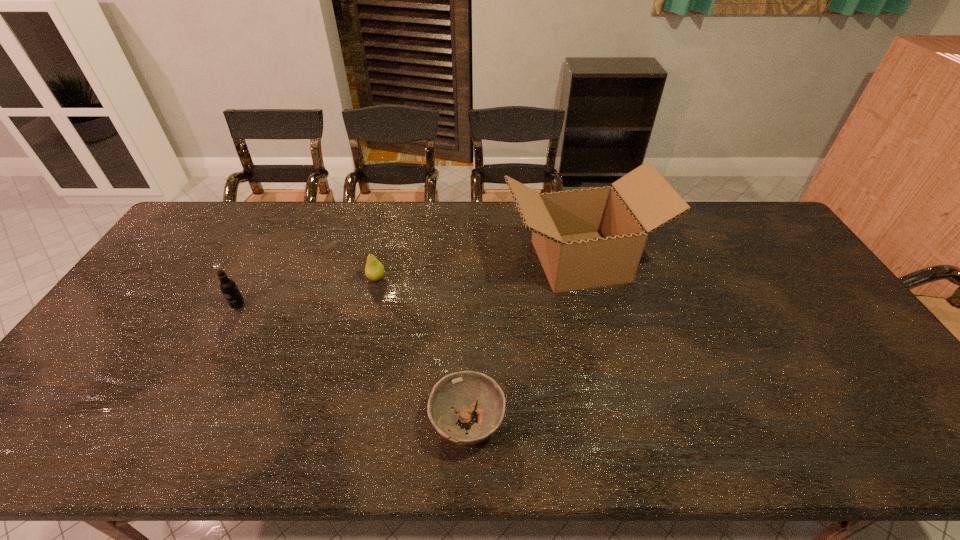
This screenshot has height=540, width=960. What are the coordinates of `box` in the screenshot? It's located at (587, 238).

Where is `the tallest object`? Image resolution: width=960 pixels, height=540 pixels. the tallest object is located at coordinates tap(587, 238).

At what (x,y) coordinates should I click in order to perform the action: click on the second nearest object. Please return your answer as a coordinate pair (x, y). This screenshot has width=960, height=540. Looking at the image, I should click on (228, 287).

Identify the location of the second tallest object. The width and height of the screenshot is (960, 540). (228, 287).

This screenshot has width=960, height=540. What are the coordinates of `the second object from left to right` in the screenshot? It's located at (374, 269).

This screenshot has height=540, width=960. I want to click on pear, so click(x=374, y=269).

This screenshot has width=960, height=540. In order to click on the shortest object in this screenshot , I will do `click(463, 390)`.

At what (x,y) coordinates should I click in order to perform the action: click on bowl. Please return your answer as a coordinate pair (x, y). Image resolution: width=960 pixels, height=540 pixels. Looking at the image, I should click on (463, 390).

I want to click on free location located 0.060m on the left of the tallest object, so click(x=484, y=261).

You are a GUI agent. You are given a task and a screenshot of the screen. Output one action in this format:
    pyautogui.click(x=<x>, y=<y>)
    Task: Click on the free location located on the label of the second tallest object
    This screenshot has height=540, width=960.
    Given the screenshot: What is the action you would take?
    pyautogui.click(x=187, y=401)